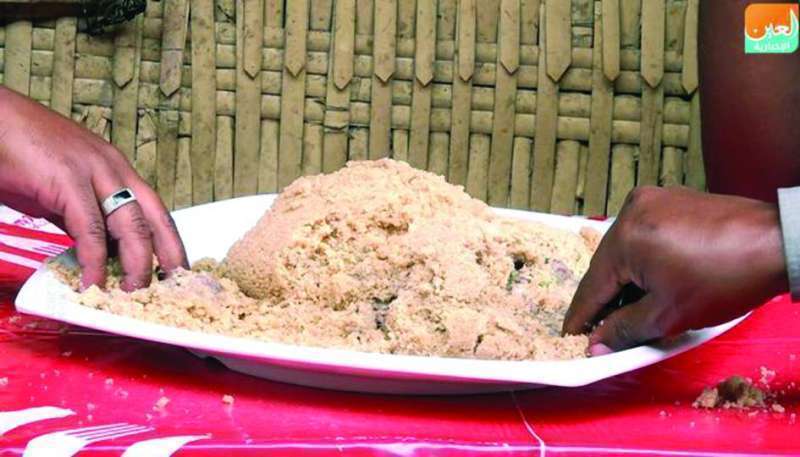
This screenshot has width=800, height=457. What are the coordinates of `back wall` in the screenshot? It's located at (256, 84).